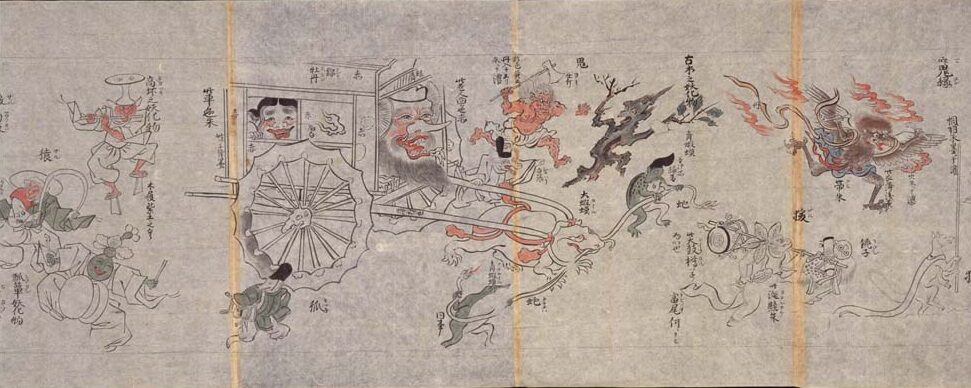
This screenshot has width=971, height=388. What are the coordinates of `painting` in the screenshot? It's located at (458, 201).